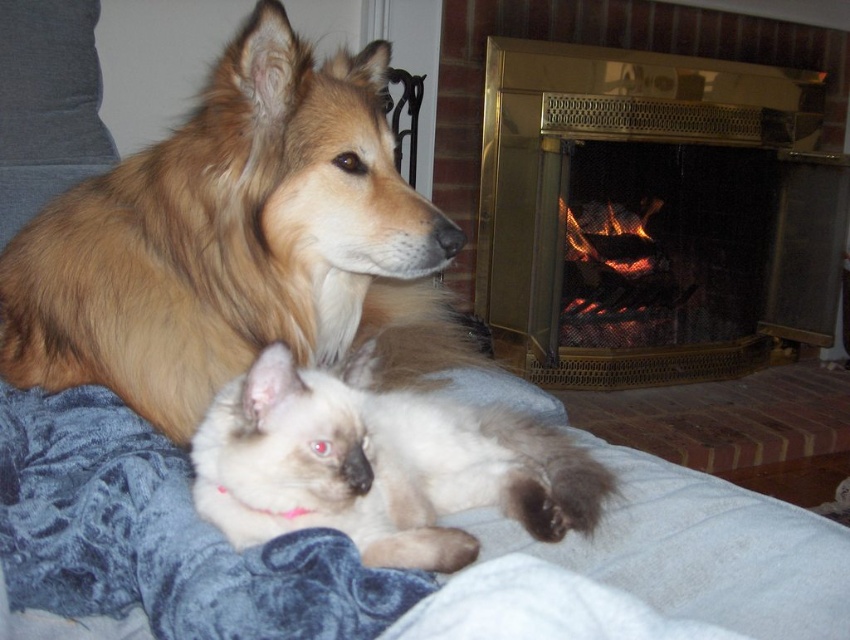
You are a photographer trying to capture a closeup of the golden fur dog at upper left. Based on the coordinates provided, where should you focus your camera?

The golden fur dog at upper left is located at coordinates point (238, 243). Focus your camera there.

You are a decorator planning to place a new rectangular rug in the living room. The rug must cover both the gold brass fireplace at upper right and the silky white cat at center. Given that the rug must be large enough to cover both objects, which object determines the minimum required width of the rug?

The gold brass fireplace at upper right has a larger width than the silky white cat at center, so the rug must be at least as wide as the gold brass fireplace at upper right to cover both objects.

In the scene shown: You are a guest in a living room where a gold brass fireplace at upper right and a silky white cat at center are present. You want to place a small decorative item on the surface nearest to you. Which object should you choose?

The gold brass fireplace at upper right has a larger size compared to the silky white cat at center, so you should place the decorative item on the surface of the gold brass fireplace at upper right since it provides more space.